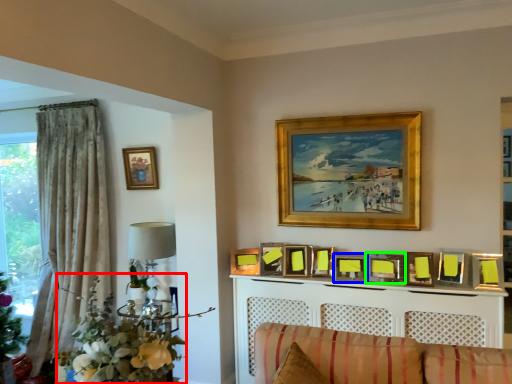
Question: Based on their relative distances, which object is farther from floral arrangement (highlighted by a red box)? Choose from picture frame (highlighted by a blue box) and picture frame (highlighted by a green box).

Choices:
 (A) picture frame
 (B) picture frame

Answer: (B)